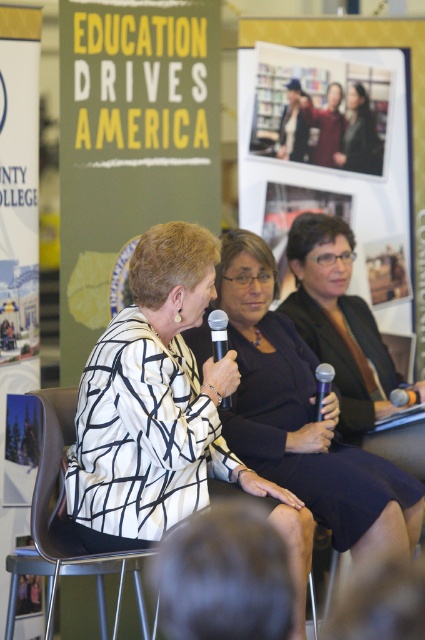
Is white and black patterned jacket at center further to camera compared to black plastic microphone at center?

No.

Does white and black patterned jacket at center appear over black plastic microphone at center?

Incorrect, white and black patterned jacket at center is not positioned above black plastic microphone at center.

Find the location of a particular element. The width and height of the screenshot is (425, 640). white and black patterned jacket at center is located at coordinates (164, 412).

Measure the distance from black glossy dress at center to silver metallic microphone at center.

black glossy dress at center and silver metallic microphone at center are 33.03 inches apart.

Between black glossy dress at center and silver metallic microphone at center, which one has less height?

Standing shorter between the two is silver metallic microphone at center.

Who is more distant from viewer, [343,244] or [215,349]?

Positioned behind is point [343,244].

Locate an element on the screen. This screenshot has width=425, height=640. black glossy dress at center is located at coordinates (339, 321).

Which of these two, matte yellow signboard at center or white paper poster at left, stands taller?

With more height is white paper poster at left.

The width and height of the screenshot is (425, 640). What do you see at coordinates (130, 141) in the screenshot?
I see `matte yellow signboard at center` at bounding box center [130, 141].

Is point (70, 4) closer to viewer compared to point (13, 124)?

No, it is not.

Identify the location of matte yellow signboard at center. Image resolution: width=425 pixels, height=640 pixels. (130, 141).